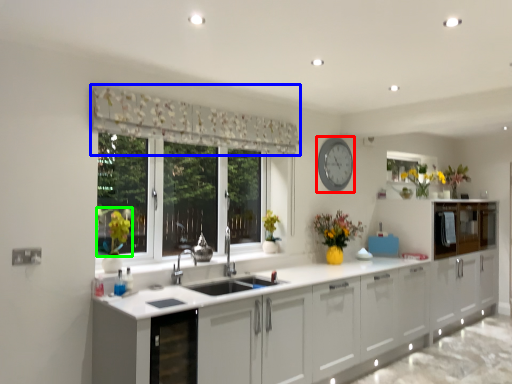
Question: Which object is positioned farthest from clock (highlighted by a red box)? Select from curtain (highlighted by a blue box) and plant (highlighted by a green box).

Choices:
 (A) curtain
 (B) plant

Answer: (B)